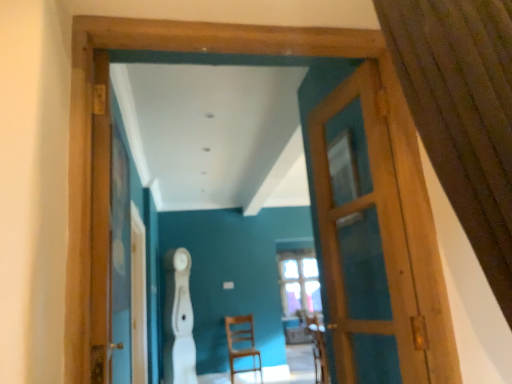
Question: Can you confirm if wooden door at center is thinner than brown textured curtain at upper right?

Choices:
 (A) yes
 (B) no

Answer: (A)

Question: Is wooden door at center oriented towards brown textured curtain at upper right?

Choices:
 (A) yes
 (B) no

Answer: (B)

Question: From the image's perspective, is wooden door at center located beneath brown textured curtain at upper right?

Choices:
 (A) yes
 (B) no

Answer: (A)

Question: Is wooden door at center not near brown textured curtain at upper right?

Choices:
 (A) yes
 (B) no

Answer: (B)

Question: Is wooden door at center outside brown textured curtain at upper right?

Choices:
 (A) yes
 (B) no

Answer: (A)

Question: Is wooden door at center taller than brown textured curtain at upper right?

Choices:
 (A) no
 (B) yes

Answer: (B)

Question: Is brown textured curtain at upper right next to wooden armchair at center?

Choices:
 (A) yes
 (B) no

Answer: (B)

Question: Can we say brown textured curtain at upper right lies outside wooden armchair at center?

Choices:
 (A) no
 (B) yes

Answer: (B)

Question: Is brown textured curtain at upper right oriented away from wooden armchair at center?

Choices:
 (A) yes
 (B) no

Answer: (B)

Question: Would you say brown textured curtain at upper right contains wooden armchair at center?

Choices:
 (A) yes
 (B) no

Answer: (B)

Question: Is brown textured curtain at upper right bigger than wooden armchair at center?

Choices:
 (A) no
 (B) yes

Answer: (B)

Question: Does brown textured curtain at upper right have a greater width compared to wooden armchair at center?

Choices:
 (A) no
 (B) yes

Answer: (B)

Question: Considering the relative positions of wooden armchair at center and wooden door at center in the image provided, is wooden armchair at center to the left of wooden door at center from the viewer's perspective?

Choices:
 (A) yes
 (B) no

Answer: (B)